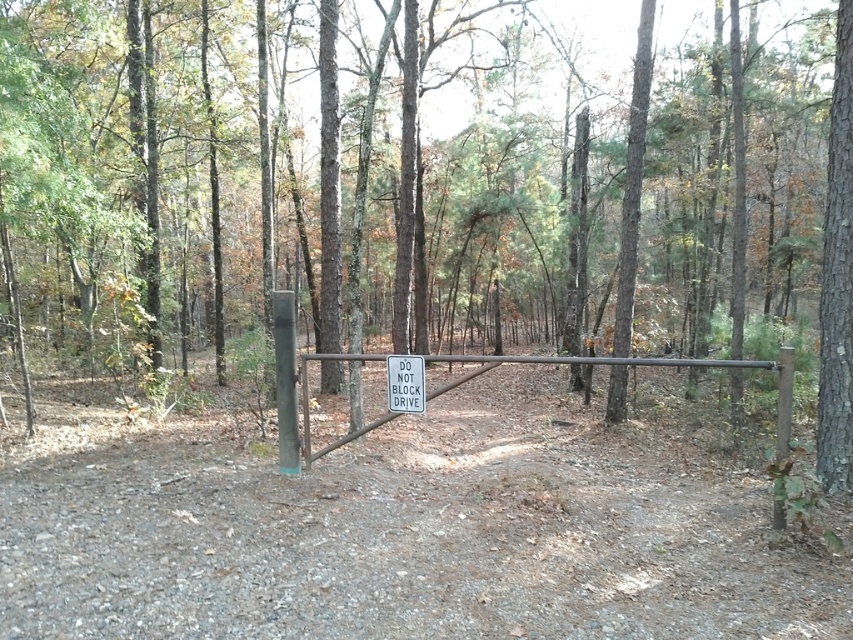
Question: Is smooth bark tree at right to the right of white plastic sign at center from the viewer's perspective?

Choices:
 (A) yes
 (B) no

Answer: (A)

Question: Which of the following is the farthest from the observer?

Choices:
 (A) white plastic sign at center
 (B) smooth bark tree at right

Answer: (B)

Question: Based on their relative distances, which object is farther from the smooth bark tree at right?

Choices:
 (A) white plastic sign at center
 (B) brown wooden gate at center

Answer: (B)

Question: Does smooth bark tree at right lie behind brown wooden gate at center?

Choices:
 (A) no
 (B) yes

Answer: (B)

Question: Considering the real-world distances, which object is closest to the white plastic sign at center?

Choices:
 (A) brown wooden gate at center
 (B) smooth bark tree at right

Answer: (B)

Question: Does brown wooden gate at center appear under white plastic sign at center?

Choices:
 (A) no
 (B) yes

Answer: (B)